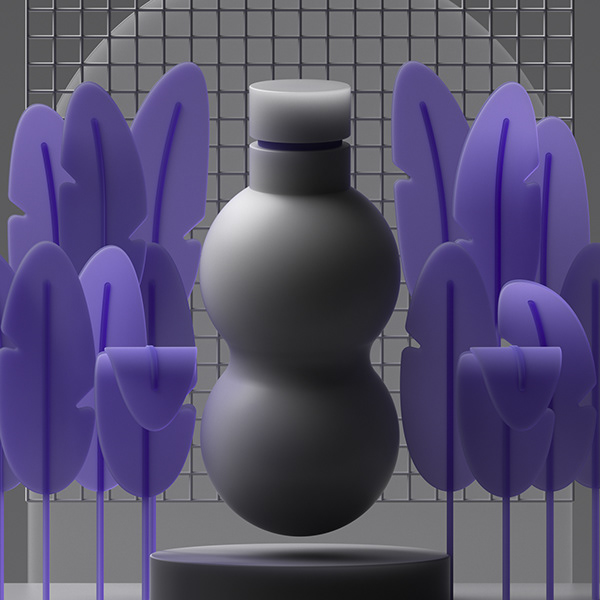
The width and height of the screenshot is (600, 600). Identify the location of corner. (573, 565).